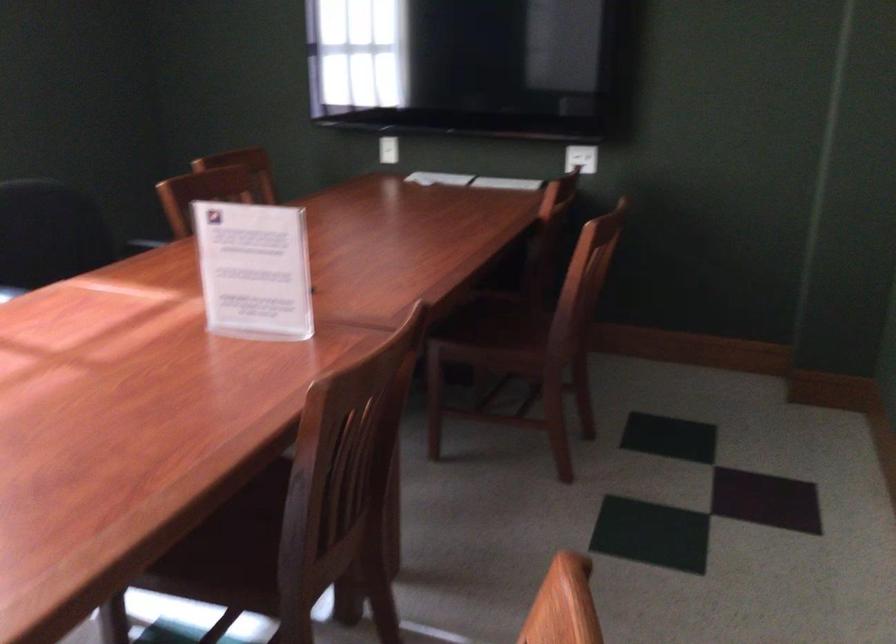
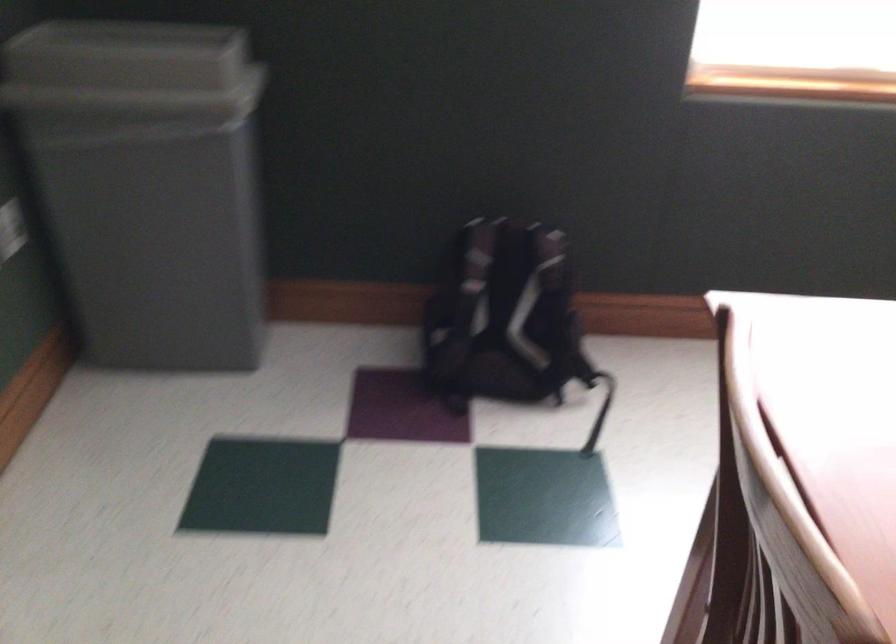
The first image is from the beginning of the video and the second image is from the end. How did the camera likely rotate when shooting the video?

The camera's rotation is toward left-down.